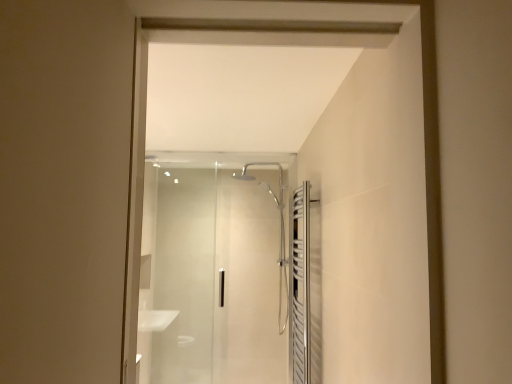
Question: Is transparent glass shower door at center, placed as the 2th screen door when sorted from front to back, at the right side of polished stainless steel towel rack at right, the first screen door in the right-to-left sequence?

Choices:
 (A) yes
 (B) no

Answer: (B)

Question: Is transparent glass shower door at center, which is the first screen door in back-to-front order, not inside polished stainless steel towel rack at right, the second screen door from the back?

Choices:
 (A) yes
 (B) no

Answer: (A)

Question: Is the position of transparent glass shower door at center, which ranks as the first screen door in left-to-right order, less distant than that of polished stainless steel towel rack at right, positioned as the first screen door in front-to-back order?

Choices:
 (A) no
 (B) yes

Answer: (A)

Question: Is transparent glass shower door at center, placed as the 2th screen door when sorted from front to back, surrounding polished stainless steel towel rack at right, the second screen door from the back?

Choices:
 (A) yes
 (B) no

Answer: (B)

Question: Does transparent glass shower door at center, placed as the 2th screen door when sorted from front to back, come behind polished stainless steel towel rack at right, marked as the 2th screen door in a left-to-right arrangement?

Choices:
 (A) no
 (B) yes

Answer: (B)

Question: Is transparent glass shower door at center, the second screen door in the right-to-left sequence, facing away from polished stainless steel towel rack at right, marked as the 2th screen door in a left-to-right arrangement?

Choices:
 (A) no
 (B) yes

Answer: (A)

Question: Is polished stainless steel towel rack at right, the second screen door from the back, oriented away from transparent glass shower door at center, which is the first screen door in back-to-front order?

Choices:
 (A) no
 (B) yes

Answer: (A)

Question: Is the depth of polished stainless steel towel rack at right, the first screen door in the right-to-left sequence, greater than that of transparent glass shower door at center, which is the first screen door in back-to-front order?

Choices:
 (A) no
 (B) yes

Answer: (A)

Question: From the image's perspective, is polished stainless steel towel rack at right, positioned as the first screen door in front-to-back order, located above transparent glass shower door at center, which ranks as the first screen door in left-to-right order?

Choices:
 (A) yes
 (B) no

Answer: (A)

Question: Considering the relative sizes of polished stainless steel towel rack at right, marked as the 2th screen door in a left-to-right arrangement, and transparent glass shower door at center, which is the first screen door in back-to-front order, in the image provided, is polished stainless steel towel rack at right, marked as the 2th screen door in a left-to-right arrangement, smaller than transparent glass shower door at center, which is the first screen door in back-to-front order,?

Choices:
 (A) yes
 (B) no

Answer: (A)

Question: Does polished stainless steel towel rack at right, positioned as the first screen door in front-to-back order, appear on the left side of transparent glass shower door at center, placed as the 2th screen door when sorted from front to back?

Choices:
 (A) yes
 (B) no

Answer: (B)

Question: From a real-world perspective, does polished stainless steel towel rack at right, the first screen door in the right-to-left sequence, stand above transparent glass shower door at center, placed as the 2th screen door when sorted from front to back?

Choices:
 (A) no
 (B) yes

Answer: (A)

Question: Is point (183, 362) positioned closer to the camera than point (300, 286)?

Choices:
 (A) farther
 (B) closer

Answer: (A)